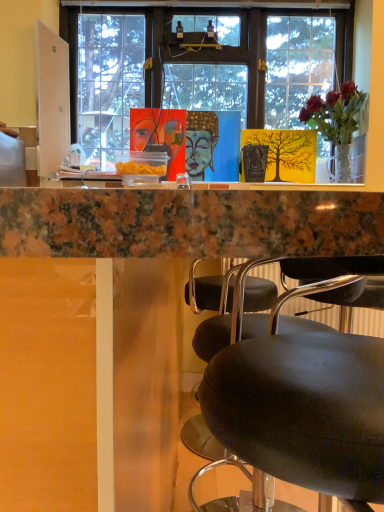
Describe the element at coordinates (336, 123) in the screenshot. I see `translucent glass vase at upper right` at that location.

Where is `translucent glass vase at upper right`? translucent glass vase at upper right is located at coordinates (336, 123).

In order to face translucent glass vase at upper right, should I rotate leftwards or rightwards?

A 17.974 degree turn to the right will do.

This screenshot has width=384, height=512. Describe the element at coordinates (190, 223) in the screenshot. I see `marble countertop at upper center` at that location.

The height and width of the screenshot is (512, 384). Find the location of `marble countertop at upper center`. marble countertop at upper center is located at coordinates (190, 223).

I want to click on translucent glass vase at upper right, so click(x=336, y=123).

Which is more to the left, marble countertop at upper center or translucent glass vase at upper right?

From the viewer's perspective, marble countertop at upper center appears more on the left side.

Between marble countertop at upper center and translucent glass vase at upper right, which one is positioned behind?

translucent glass vase at upper right is further from the camera.

Considering the points (90, 248) and (352, 84), which point is in front, point (90, 248) or point (352, 84)?

The point (90, 248) is closer to the camera.

From the image's perspective, is marble countertop at upper center on translucent glass vase at upper right?

No.

From a real-world perspective, which object stands above the other?

translucent glass vase at upper right.

Which object is wider, marble countertop at upper center or translucent glass vase at upper right?

With larger width is marble countertop at upper center.

Does marble countertop at upper center have a lesser height compared to translucent glass vase at upper right?

No, marble countertop at upper center is not shorter than translucent glass vase at upper right.

Consider the image. In terms of size, does marble countertop at upper center appear bigger or smaller than translucent glass vase at upper right?

Considering their sizes, marble countertop at upper center takes up more space than translucent glass vase at upper right.

Is marble countertop at upper center inside or outside of translucent glass vase at upper right?

marble countertop at upper center cannot be found inside translucent glass vase at upper right.

Are marble countertop at upper center and translucent glass vase at upper right far apart?

That's right, there is a large distance between marble countertop at upper center and translucent glass vase at upper right.

Is marble countertop at upper center oriented away from translucent glass vase at upper right?

marble countertop at upper center does not have its back to translucent glass vase at upper right.

What's the angular difference between marble countertop at upper center and translucent glass vase at upper right's facing directions?

91.6 degrees.

Identify the location of desk in front of the translucent glass vase at upper right. Image resolution: width=384 pixels, height=512 pixels. (190, 223).

Considering the relative positions of translucent glass vase at upper right and marble countertop at upper center in the image provided, is translucent glass vase at upper right to the left or to the right of marble countertop at upper center?

From the image, it's evident that translucent glass vase at upper right is to the right of marble countertop at upper center.

Is translucent glass vase at upper right behind marble countertop at upper center?

That is True.

Between point (341, 149) and point (284, 215), which one is positioned in front?

Point (284, 215)

From the image's perspective, who appears lower, translucent glass vase at upper right or marble countertop at upper center?

marble countertop at upper center is shown below in the image.

From a real-world perspective, is translucent glass vase at upper right above or below marble countertop at upper center?

In terms of real-world spatial position, translucent glass vase at upper right is above marble countertop at upper center.

Between translucent glass vase at upper right and marble countertop at upper center, which one has larger width?

marble countertop at upper center is wider.

Does translucent glass vase at upper right have a greater height compared to marble countertop at upper center?

In fact, translucent glass vase at upper right may be shorter than marble countertop at upper center.

Between translucent glass vase at upper right and marble countertop at upper center, which one has smaller size?

translucent glass vase at upper right is smaller.

Is translucent glass vase at upper right surrounding marble countertop at upper center?

No, marble countertop at upper center is not a part of translucent glass vase at upper right.

From the picture: Is there a large distance between translucent glass vase at upper right and marble countertop at upper center?

Yes, translucent glass vase at upper right and marble countertop at upper center are quite far apart.

Is translucent glass vase at upper right facing away from marble countertop at upper center?

No, translucent glass vase at upper right is not facing the opposite direction of marble countertop at upper center.

You are a GUI agent. You are given a task and a screenshot of the screen. Output one action in this format:
    pyautogui.click(x=<x>, y=<y>)
    Task: Click on the houseplant behind the marble countertop at upper center
    This screenshot has width=384, height=512.
    Given the screenshot: What is the action you would take?
    pyautogui.click(x=336, y=123)

Image resolution: width=384 pixels, height=512 pixels. In order to click on houseplant above the marble countertop at upper center (from a real-world perspective) in this screenshot , I will do pyautogui.click(x=336, y=123).

Identify the location of houseplant that appears above the marble countertop at upper center (from the image's perspective). (336, 123).